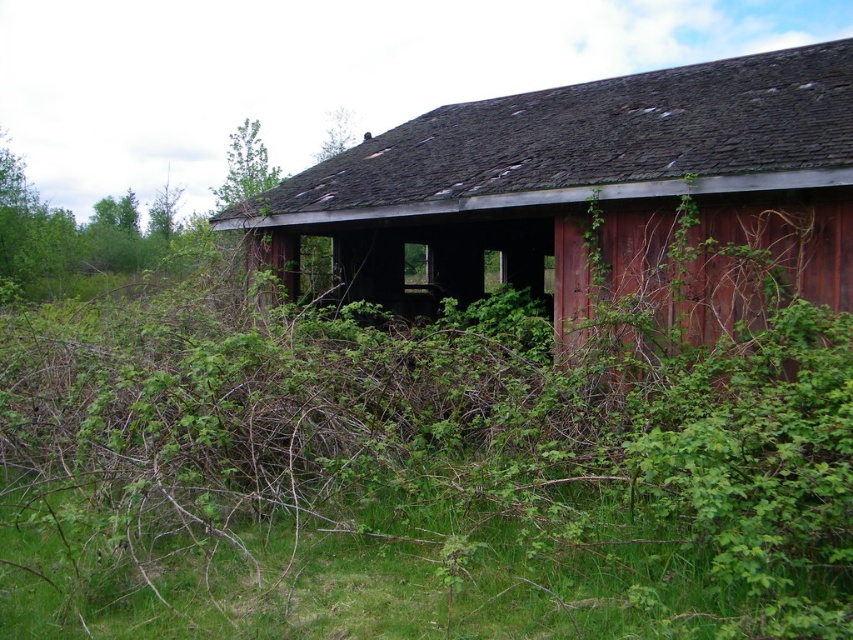
Can you confirm if green grass at lower center is bigger than green leafy tree at upper left?

No.

Where is `green grass at lower center`? green grass at lower center is located at coordinates (381, 579).

Looking at this image, does rusty wood barn at center have a larger size compared to green grass at lower center?

Yes, rusty wood barn at center is bigger than green grass at lower center.

Between point (593, 170) and point (358, 554), which one is positioned in front?

Point (358, 554) is in front.

Is point (508, 227) farther from camera compared to point (416, 531)?

Yes, it is.

Locate an element on the screen. rusty wood barn at center is located at coordinates click(592, 193).

Between green leafy tree at upper left and green leafy tree at upper center, which one has less height?

green leafy tree at upper center is shorter.

The width and height of the screenshot is (853, 640). What do you see at coordinates (245, 166) in the screenshot? I see `green leafy tree at upper left` at bounding box center [245, 166].

This screenshot has height=640, width=853. In order to click on green leafy tree at upper left in this screenshot , I will do `click(245, 166)`.